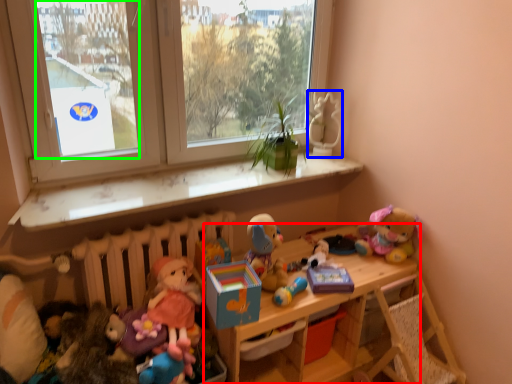
Question: Considering the real-world distances, which object is farthest from shelf (highlighted by a red box)? miniature (highlighted by a blue box) or window screen (highlighted by a green box)?

Choices:
 (A) miniature
 (B) window screen

Answer: (B)